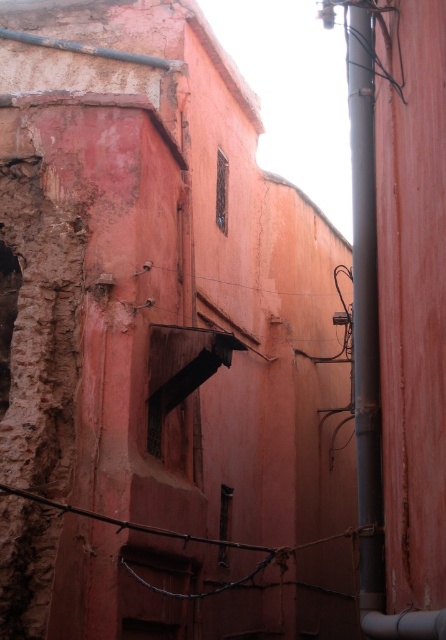
You are a maintenance worker in the alleyway. You need to attach a new sensor to the tallest object between the metallic pipe at right and the rusty metal wire at center. Which object should you choose?

The metallic pipe at right is much taller than the rusty metal wire at center, so you should attach the sensor to the metallic pipe at right.

You are standing in the alleyway between the two buildings. You notice two points marked on the wall. The first point is at coordinate (360, 390) and the second is at (198, 538). If you want to touch the point that is closer to you, which coordinate should you aim for?

You should aim for point (360, 390) because it is closer to the viewer than point (198, 538).

You are a maintenance worker needing to replace a larger object in the alley. Which object between the metallic pipe at right and the rusty metal wire at center should you choose to replace?

The metallic pipe at right is larger in size than the rusty metal wire at center, so you should choose to replace the metallic pipe at right.